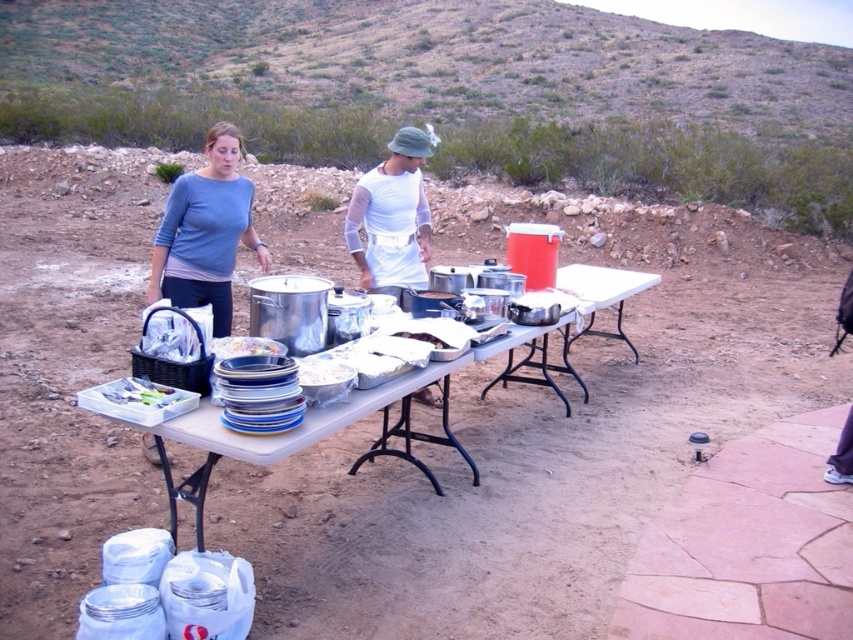
Is blue cotton shirt at upper left smaller than white plastic plate at center?

No, blue cotton shirt at upper left is not smaller than white plastic plate at center.

Between point (181, 264) and point (248, 346), which one is positioned behind?

The point (181, 264) is behind.

Identify the location of blue cotton shirt at upper left. (206, 230).

Who is positioned more to the right, white plastic table at center or clear plastic container at lower left?

white plastic table at center is more to the right.

Is white plastic table at center bigger than clear plastic container at lower left?

Indeed, white plastic table at center has a larger size compared to clear plastic container at lower left.

You are a GUI agent. You are given a task and a screenshot of the screen. Output one action in this format:
    pyautogui.click(x=<x>, y=<y>)
    Task: Click on the white plastic table at center
    
    Given the screenshot: What is the action you would take?
    pyautogui.click(x=291, y=432)

Is white plastic table at center taller than white plastic plate at center?

Correct, white plastic table at center is much taller as white plastic plate at center.

Is white plastic table at center in front of white plastic plate at center?

That is True.

Where is `white plastic table at center`? Image resolution: width=853 pixels, height=640 pixels. white plastic table at center is located at coordinates (291, 432).